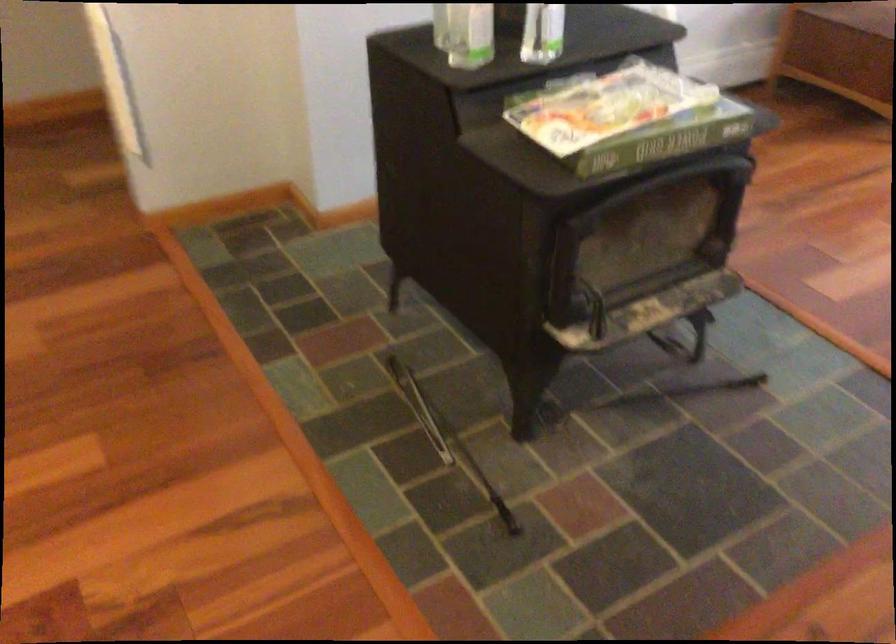
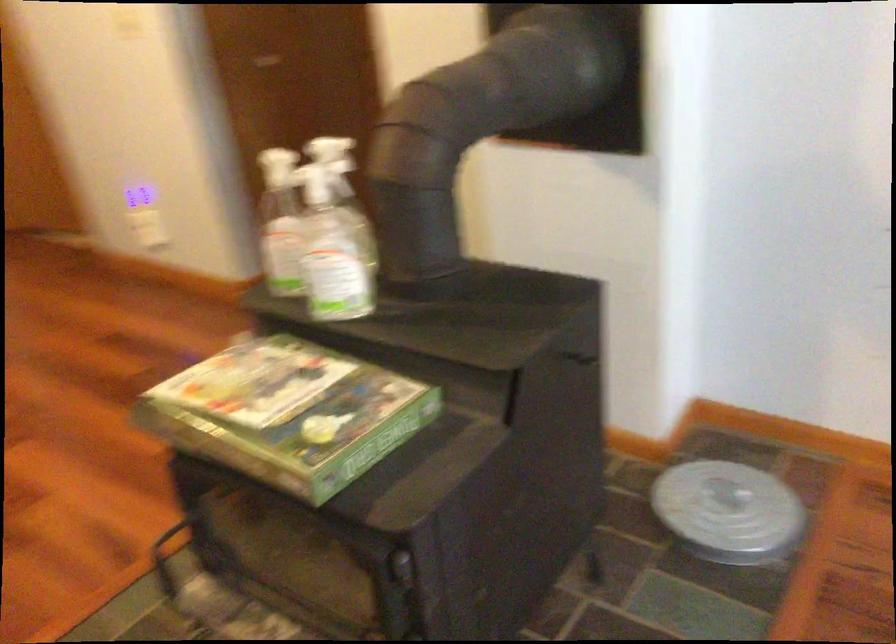
Where in the second image is the point corresponding to (x=751, y=163) from the first image?

(401, 567)